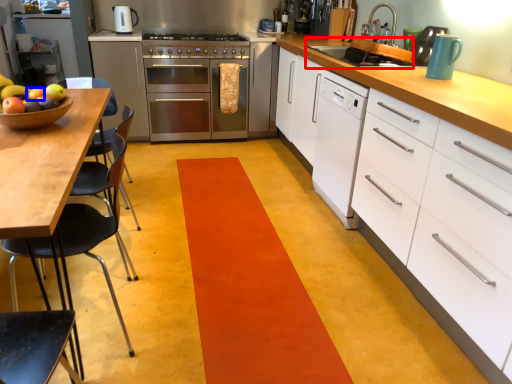
Question: Which of the following is the farthest to the observer, sink (highlighted by a red box) or apple (highlighted by a blue box)?

Choices:
 (A) sink
 (B) apple

Answer: (A)